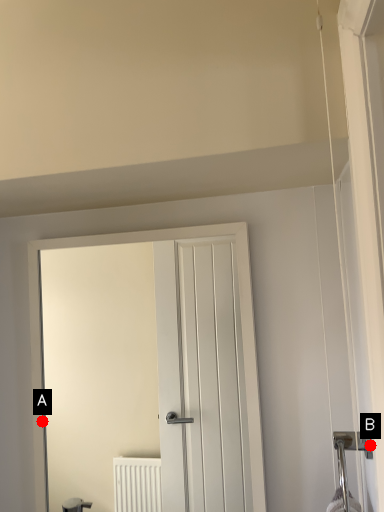
Question: Two points are circled on the image, labeled by A and B beside each circle. Which point appears closest to the camera in this image?

Choices:
 (A) A is closer
 (B) B is closer

Answer: (B)